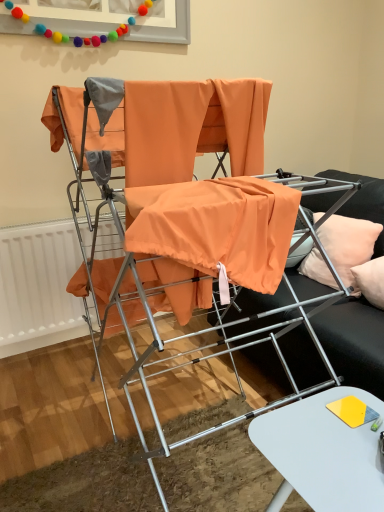
This screenshot has height=512, width=384. Describe the element at coordinates (38, 285) in the screenshot. I see `white matte radiator at lower left` at that location.

Measure the distance between white glossy table at lower right and camera.

A distance of 32.72 inches exists between white glossy table at lower right and camera.

This screenshot has height=512, width=384. What do you see at coordinates (323, 453) in the screenshot?
I see `white glossy table at lower right` at bounding box center [323, 453].

The image size is (384, 512). Describe the element at coordinates (348, 244) in the screenshot. I see `peach fabric pillow at right` at that location.

Describe the element at coordinates (237, 123) in the screenshot. The height and width of the screenshot is (512, 384). I see `orange fabric at center` at that location.

Image resolution: width=384 pixels, height=512 pixels. What do you see at coordinates (354, 342) in the screenshot?
I see `orange fabric at center` at bounding box center [354, 342].

Locate an element on the screen. Image resolution: width=384 pixels, height=512 pixels. white matte radiator at lower left is located at coordinates (38, 285).

Is orange fabric at center touching orange fabric at center?

No, orange fabric at center is not beside orange fabric at center.

Does orange fabric at center have a lesser height compared to orange fabric at center?

Yes.

In the image, is orange fabric at center positioned in front of or behind orange fabric at center?

Visually, orange fabric at center is located behind orange fabric at center.

From a real-world perspective, is orange fabric at center above or below orange fabric at center?

orange fabric at center is above orange fabric at center.

How far apart are orange fabric at center and white matte radiator at lower left?

The distance of orange fabric at center from white matte radiator at lower left is 1.04 meters.

From a real-world perspective, who is located higher, orange fabric at center or white matte radiator at lower left?

orange fabric at center, from a real-world perspective.

Considering the relative positions of orange fabric at center and white matte radiator at lower left in the image provided, is orange fabric at center in front of white matte radiator at lower left?

Yes, orange fabric at center is closer to the camera.

Can you confirm if orange fabric at center is wider than white matte radiator at lower left?

Indeed, orange fabric at center has a greater width compared to white matte radiator at lower left.

Is point (43, 229) positioned before point (333, 248)?

No, (43, 229) is behind (333, 248).

In the scene shown: Is white matte radiator at lower left surrounding peach fabric pillow at right?

No, peach fabric pillow at right is not inside white matte radiator at lower left.

From the image's perspective, is white matte radiator at lower left on peach fabric pillow at right?

Incorrect, from the image's perspective, white matte radiator at lower left is lower than peach fabric pillow at right.

Consider the image. Which object is positioned more to the left, peach fabric pillow at right or orange fabric at center?

orange fabric at center.

From the picture: Is peach fabric pillow at right shorter than orange fabric at center?

Indeed, peach fabric pillow at right has a lesser height compared to orange fabric at center.

Based on the photo, from a real-world perspective, is peach fabric pillow at right below orange fabric at center?

A: Incorrect, from a real-world perspective, peach fabric pillow at right is higher than orange fabric at center.

Which is nearer, [369,255] or [343,316]?

Point [369,255].

From the image's perspective, which is below, white matte radiator at lower left or orange fabric at center?

From the image's view, white matte radiator at lower left is below.

Is white matte radiator at lower left aimed at orange fabric at center?

No.

Considering the positions of objects white matte radiator at lower left and orange fabric at center in the image provided, who is more to the right, white matte radiator at lower left or orange fabric at center?

orange fabric at center.

Which point is more forward, (6, 327) or (377, 371)?

Positioned in front is point (377, 371).

Looking at this image, is there a large distance between orange fabric chair at center and white glossy table at lower right?

No, there isn't a large distance between orange fabric chair at center and white glossy table at lower right.

Considering the positions of objects orange fabric chair at center and white glossy table at lower right in the image provided, who is more to the left, orange fabric chair at center or white glossy table at lower right?

From the viewer's perspective, orange fabric chair at center appears more on the left side.

Between orange fabric chair at center and white glossy table at lower right, which one has more height?

orange fabric chair at center.

From the picture: How far apart are orange fabric chair at center and white glossy table at lower right?

The distance of orange fabric chair at center from white glossy table at lower right is 20.44 inches.

Does orange fabric at center come behind white glossy table at lower right?

Yes, the depth of orange fabric at center is greater than that of white glossy table at lower right.

Is orange fabric at center aimed at white glossy table at lower right?

Yes, orange fabric at center is aimed at white glossy table at lower right.

Is orange fabric at center taller than white glossy table at lower right?

Indeed, orange fabric at center has a greater height compared to white glossy table at lower right.

Find the location of a particular element. The width and height of the screenshot is (384, 512). fabric located on the left of orange fabric at center is located at coordinates (237, 123).

Where is `studio couch above the white matte radiator at lower left (from a real-world perspective)`? This screenshot has width=384, height=512. studio couch above the white matte radiator at lower left (from a real-world perspective) is located at coordinates (354, 342).

When comparing their distances from white glossy table at lower right, does white matte radiator at lower left or orange fabric at center seem closer?

orange fabric at center.

Which object lies further to the anchor point orange fabric at center, peach fabric pillow at right or orange fabric at center?

orange fabric at center lies further to orange fabric at center than the other object.

From the image, which object appears to be nearer to white glossy table at lower right, orange fabric chair at center or peach fabric pillow at right?

Among the two, orange fabric chair at center is located nearer to white glossy table at lower right.

Which object lies further to the anchor point orange fabric at center, white matte radiator at lower left or white glossy table at lower right?

Among the two, white matte radiator at lower left is located further to orange fabric at center.

Looking at this image, estimate the real-world distances between objects in this image. Which object is closer to white matte radiator at lower left, white glossy table at lower right or orange fabric at center?

Based on the image, orange fabric at center appears to be nearer to white matte radiator at lower left.

Which object lies further to the anchor point white glossy table at lower right, orange fabric chair at center or orange fabric at center?

orange fabric chair at center.

Estimate the real-world distances between objects in this image. Which object is closer to white matte radiator at lower left, orange fabric chair at center or orange fabric at center?

Based on the image, orange fabric chair at center appears to be nearer to white matte radiator at lower left.

In the scene shown: Based on their spatial positions, is peach fabric pillow at right or orange fabric at center further from white glossy table at lower right?

Based on the image, peach fabric pillow at right appears to be further to white glossy table at lower right.

At what (x,y) coordinates should I click in order to perform the action: click on chair between white matte radiator at lower left and orange fabric at center in the horizontal direction. Please return your answer as a coordinate pair (x, y). This screenshot has height=512, width=384. Looking at the image, I should click on (182, 232).

Image resolution: width=384 pixels, height=512 pixels. What are the coordinates of `chair located between white glossy table at lower right and white matte radiator at lower left in the depth direction` in the screenshot? It's located at pyautogui.click(x=182, y=232).

Find the location of `studio couch between orange fabric at center and white glossy table at lower right in the vertical direction`. studio couch between orange fabric at center and white glossy table at lower right in the vertical direction is located at coordinates (354, 342).

What are the coordinates of `fabric between white matte radiator at lower left and white glossy table at lower right in the horizontal direction` in the screenshot? It's located at click(x=237, y=123).